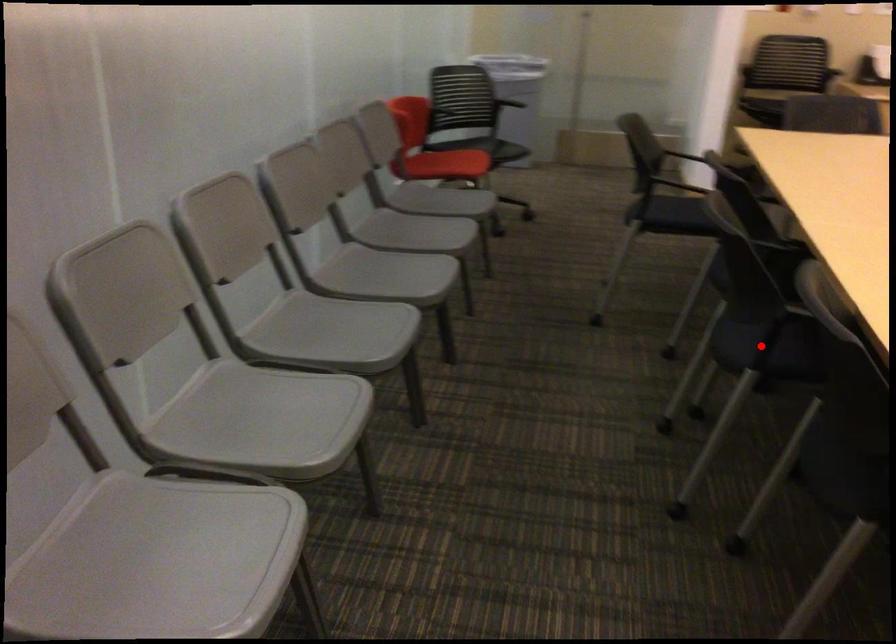
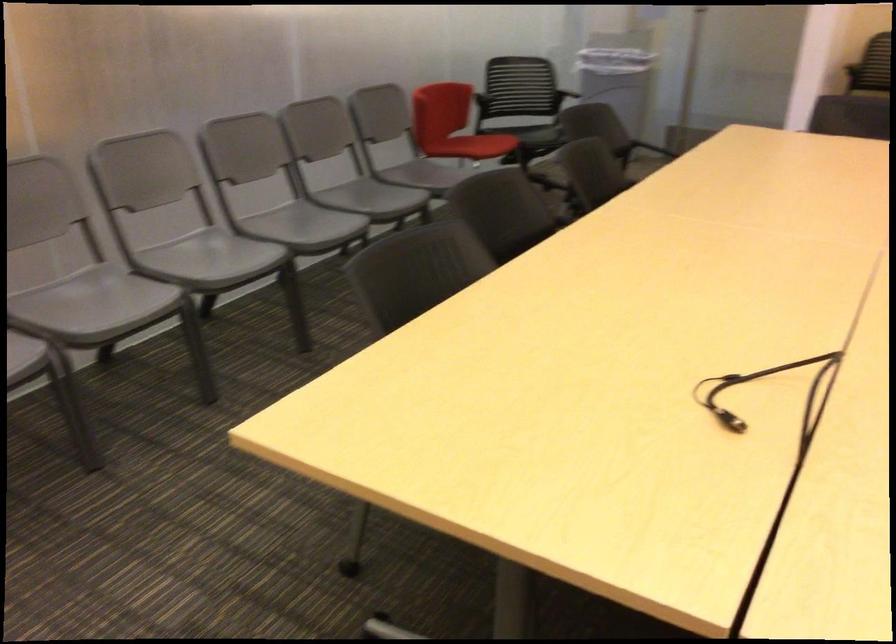
Question: I am providing you with two images of the same scene from different viewpoints. A red point is marked on the first image. At the location where the point appears in image 1, is it still visible in image 2?

Choices:
 (A) Yes
 (B) No

Answer: (B)